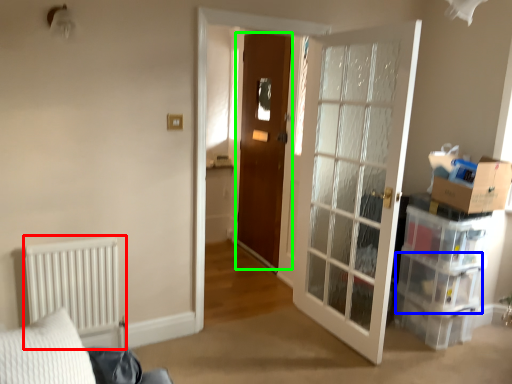
Question: Based on their relative distances, which object is nearer to radiator (highlighted by a red box)? Choose from drawer (highlighted by a blue box) and door (highlighted by a green box).

Choices:
 (A) drawer
 (B) door

Answer: (B)